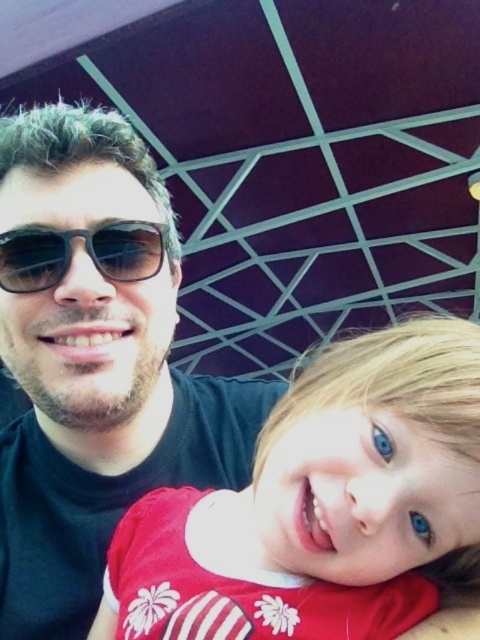
Consider the image. You are standing in front of the image and want to determine which of the two points, point (20, 456) or point (96, 257), is closer to you. Based on the scene, which point is nearer?

Point (20, 456) is closer to you because it is further to the viewer than point (96, 257).

You are a photographer trying to capture a closeup of the matte red shirt at center without the matte black sunglasses at upper left blocking the view. Based on their positions, is this possible?

The matte black sunglasses at upper left are positioned over the matte red shirt at center, so they are blocking the view of the matte red shirt at center. Therefore, it is not possible to take a closeup of the matte red shirt at center without the sunglasses obstructing the shot.